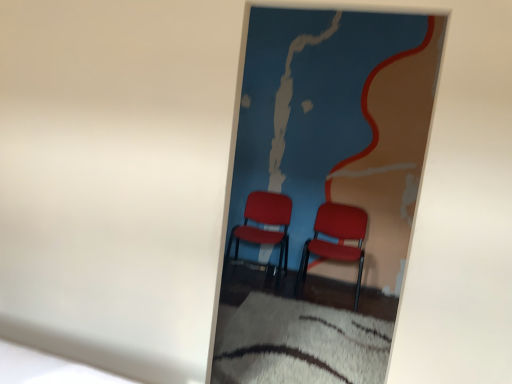
Question: Does matte red chair at center, arranged as the 2th chair when viewed from the left, appear on the left side of matte plastic chairs at center?

Choices:
 (A) no
 (B) yes

Answer: (A)

Question: Is matte red chair at center, arranged as the 2th chair when viewed from the left, bigger than matte plastic chairs at center?

Choices:
 (A) no
 (B) yes

Answer: (B)

Question: From a real-world perspective, does matte red chair at center, marked as the 1th chair in a right-to-left arrangement, sit lower than matte plastic chairs at center?

Choices:
 (A) yes
 (B) no

Answer: (A)

Question: Is matte red chair at center, marked as the 1th chair in a right-to-left arrangement, facing away from matte plastic chairs at center?

Choices:
 (A) no
 (B) yes

Answer: (A)

Question: Can you confirm if matte red chair at center, arranged as the 2th chair when viewed from the left, is smaller than matte plastic chairs at center?

Choices:
 (A) yes
 (B) no

Answer: (B)

Question: Is white shaggy rug at lower center wider or thinner than matte plastic chairs at center?

Choices:
 (A) wide
 (B) thin

Answer: (A)

Question: From the image's perspective, is white shaggy rug at lower center positioned above or below matte plastic chairs at center?

Choices:
 (A) below
 (B) above

Answer: (A)

Question: Considering their positions, is white shaggy rug at lower center located in front of or behind matte plastic chairs at center?

Choices:
 (A) front
 (B) behind

Answer: (B)

Question: Based on their positions, is white shaggy rug at lower center located to the left or right of matte plastic chairs at center?

Choices:
 (A) right
 (B) left

Answer: (A)

Question: From a real-world perspective, is matte plastic chair at center, which ranks as the second chair in right-to-left order, positioned above or below matte red chair at center, marked as the 1th chair in a right-to-left arrangement?

Choices:
 (A) above
 (B) below

Answer: (A)

Question: Based on their sizes in the image, would you say matte plastic chair at center, which ranks as the second chair in right-to-left order, is bigger or smaller than matte red chair at center, marked as the 1th chair in a right-to-left arrangement?

Choices:
 (A) small
 (B) big

Answer: (B)

Question: Is matte plastic chair at center, the 1th chair from the left, taller or shorter than matte red chair at center, arranged as the 2th chair when viewed from the left?

Choices:
 (A) short
 (B) tall

Answer: (B)

Question: Looking at their shapes, would you say matte plastic chair at center, which ranks as the second chair in right-to-left order, is wider or thinner than matte red chair at center, arranged as the 2th chair when viewed from the left?

Choices:
 (A) wide
 (B) thin

Answer: (A)

Question: In terms of width, does matte plastic chairs at center look wider or thinner when compared to white shaggy rug at lower center?

Choices:
 (A) thin
 (B) wide

Answer: (A)

Question: From the image's perspective, relative to white shaggy rug at lower center, is matte plastic chairs at center above or below?

Choices:
 (A) above
 (B) below

Answer: (A)